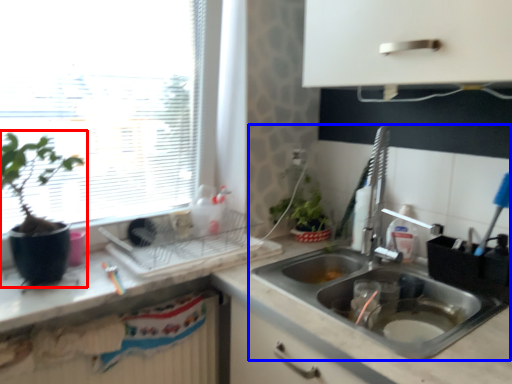
Question: Which of the following is the farthest to the observer, houseplant (highlighted by a red box) or sink (highlighted by a blue box)?

Choices:
 (A) houseplant
 (B) sink

Answer: (B)